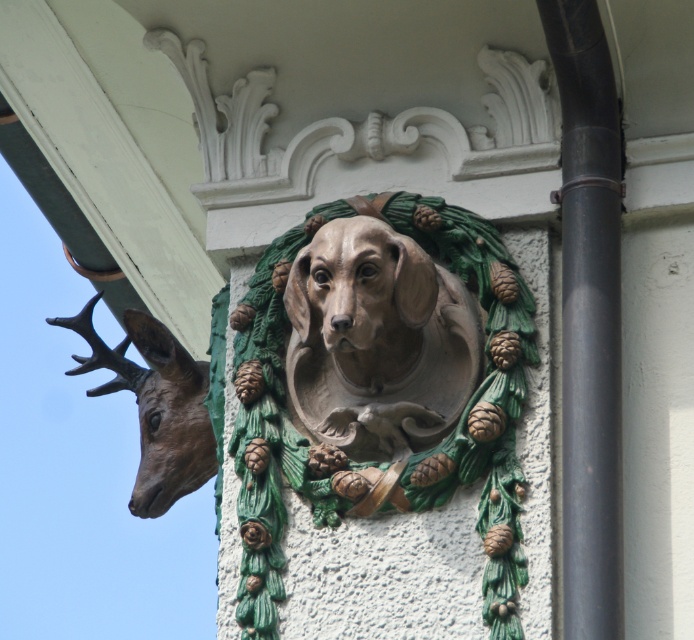
You are an architect examining the building facade. You need to install a new decorative element that requires a base wider than the existing objects. Which object between the matte gray stone dog at center and the black matte pipe at right should you avoid placing the base near to ensure sufficient space?

You should avoid placing the base near the black matte pipe at right because it is wider than the matte gray stone dog at center, making it less suitable for requiring a wider base.

You are an art conservator examining the relief. You need to clean the matte gray stone dog at center and the bronze textured deer head at left. Which object should you clean first if you want to start with the one that is closer to you?

The matte gray stone dog at center is in front of the bronze textured deer head at left, so you should clean the matte gray stone dog at center first since it is closer to you.